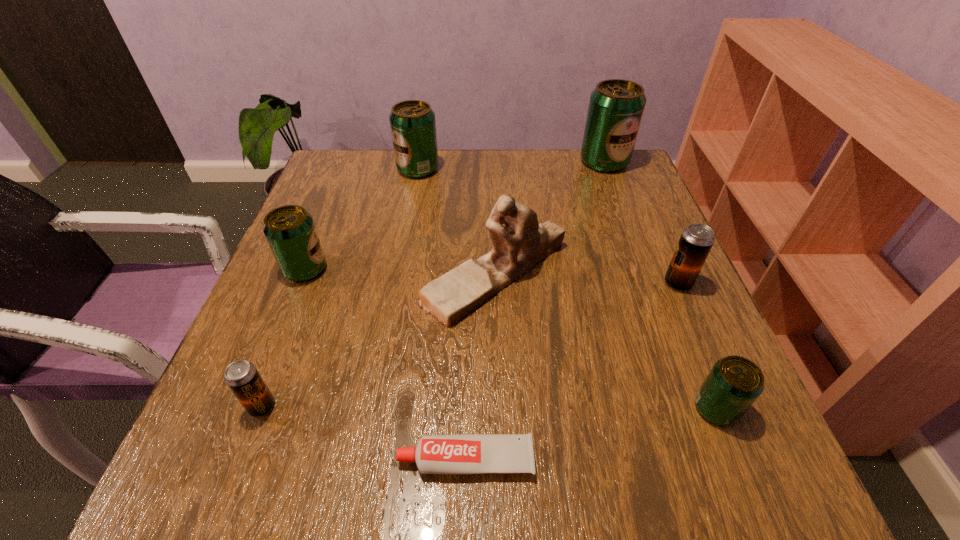
The width and height of the screenshot is (960, 540). Find the location of `the smaller black beer can`. the smaller black beer can is located at coordinates (242, 377).

This screenshot has height=540, width=960. What are the coordinates of `the nearest object` in the screenshot? It's located at (472, 453).

Identify the location of the shortest object. Image resolution: width=960 pixels, height=540 pixels. (472, 453).

The width and height of the screenshot is (960, 540). In order to click on vacant position located 0.350m on the left of the biggest green beer can in this screenshot , I will do `click(449, 162)`.

In order to click on free space located 0.080m on the front-facing side of the figurine in this screenshot , I will do `click(382, 274)`.

Locate an element on the screen. Image resolution: width=960 pixels, height=540 pixels. free space located 0.160m on the front-facing side of the figurine is located at coordinates (342, 274).

At what (x,y) coordinates should I click in order to perform the action: click on free spot located 0.170m on the front-facing side of the figurine. Please return your answer as a coordinate pair (x, y). The width and height of the screenshot is (960, 540). Looking at the image, I should click on click(x=337, y=274).

Locate an element on the screen. The image size is (960, 540). vacant space situated 0.290m on the front of the second green beer can from left to right is located at coordinates (401, 258).

Where is `vacant area situated 0.330m on the right of the third farthest green beer can`? This screenshot has height=540, width=960. vacant area situated 0.330m on the right of the third farthest green beer can is located at coordinates (490, 269).

At what (x,y) coordinates should I click in order to perform the action: click on vacant position located 0.260m on the left of the bigger black beer can. Please return your answer as a coordinate pair (x, y). Looking at the image, I should click on (531, 283).